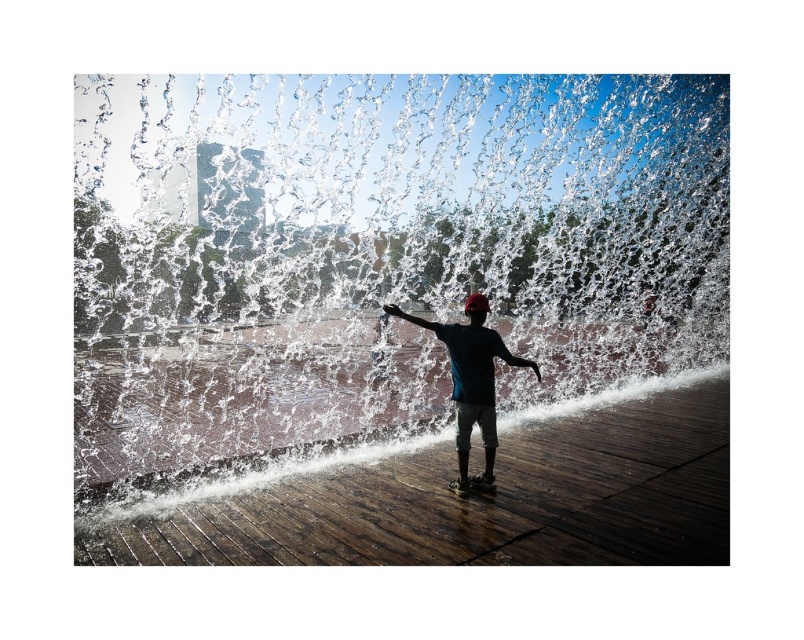
Question: Is clear water at center to the left of dark blue fabric shirt at center from the viewer's perspective?

Choices:
 (A) yes
 (B) no

Answer: (A)

Question: Which point is farther to the camera?

Choices:
 (A) (461, 333)
 (B) (379, 250)

Answer: (B)

Question: Is clear water at center below dark blue fabric shirt at center?

Choices:
 (A) yes
 (B) no

Answer: (B)

Question: Can you confirm if clear water at center is positioned below dark blue fabric shirt at center?

Choices:
 (A) yes
 (B) no

Answer: (B)

Question: Which point is farther from the camera taking this photo?

Choices:
 (A) (542, 275)
 (B) (466, 401)

Answer: (A)